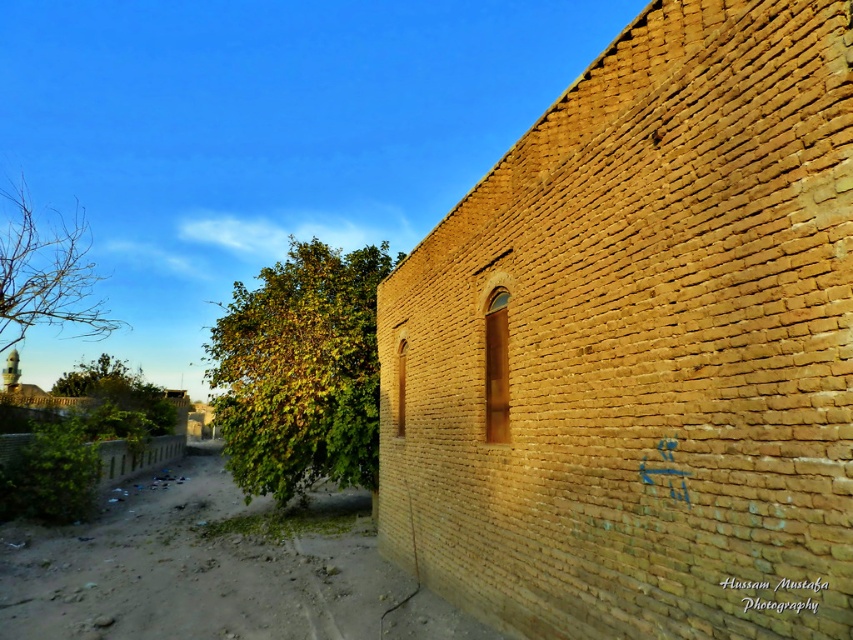
You are a landscape architect designing a garden. You need to place a bench between the green leafy tree at center and the bare branches at upper left. The bench requires 12 meters of space between the two trees to be placed safely. Can you place the bench between them?

The green leafy tree at center and the bare branches at upper left are 11.99 meters apart, which is less than the required 12 meters. Therefore, the bench cannot be placed between them safely.

You are standing at the point marked by the coordinates point (300, 371) in the image. Looking around, you see a rustic brick wall and a dirt path. Which direction should you walk to reach the green leafy tree at center?

The point (300, 371) indicates the green leafy tree at center, so you are already at the location of the tree. There is no need to walk further.

You are standing in front of the rustic brick wall and want to take a photo of the bare branches at upper left. Where should you position your camera to capture the branches in the upper left corner of the photo?

Position your camera so that the bare branches at upper left are centered at the coordinates point (45, 275) to capture them in the upper left corner of the photo.